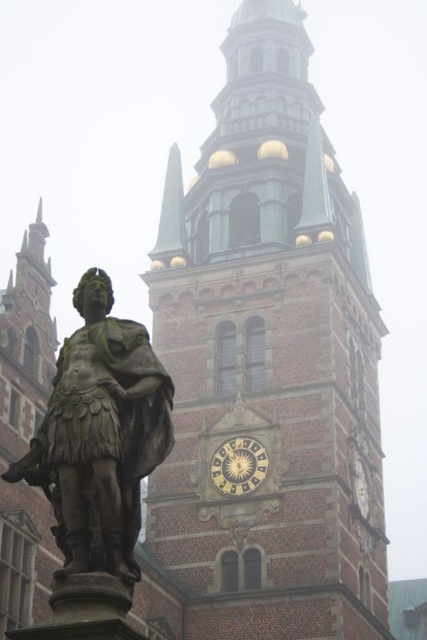
You are standing at the camera position and want to take a photo of the brown brick tower at center. If your camera has a maximum focus range of 50 meters, will it be able to capture the tower clearly?

The brown brick tower at center and camera are 51.78 meters apart from each other, so the camera cannot focus on the tower since it exceeds the maximum range of 50 meters.

You are standing in front of the historical tower and want to take a photo of both the green polished stone spire at upper center and the goldmetallicclock at center. Which object should you focus on first to ensure both are in clear view?

You should focus on the green polished stone spire at upper center first because it is closer to you than the goldmetallicclock at center, so adjusting focus from near to far will help capture both clearly.